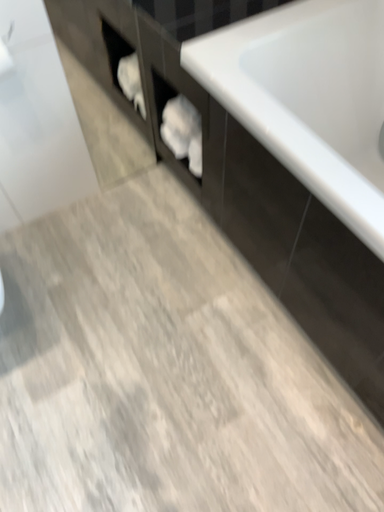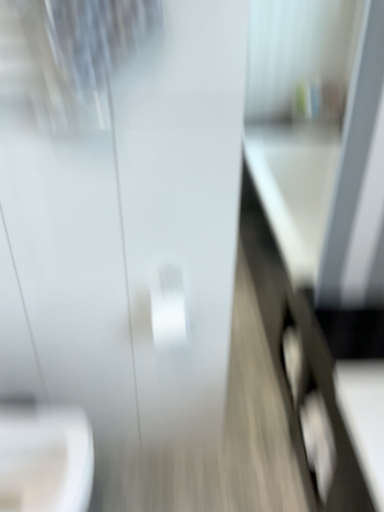
Question: How did the camera likely rotate when shooting the video?

Choices:
 (A) rotated left
 (B) rotated right

Answer: (A)